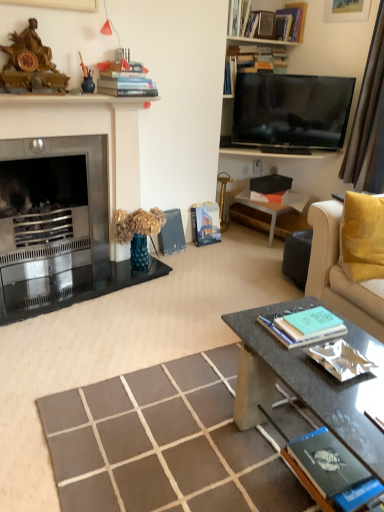
Locate an element on the screen. free location to the left of teal matte book at center, which is the 7th book from top to bottom is located at coordinates (254, 326).